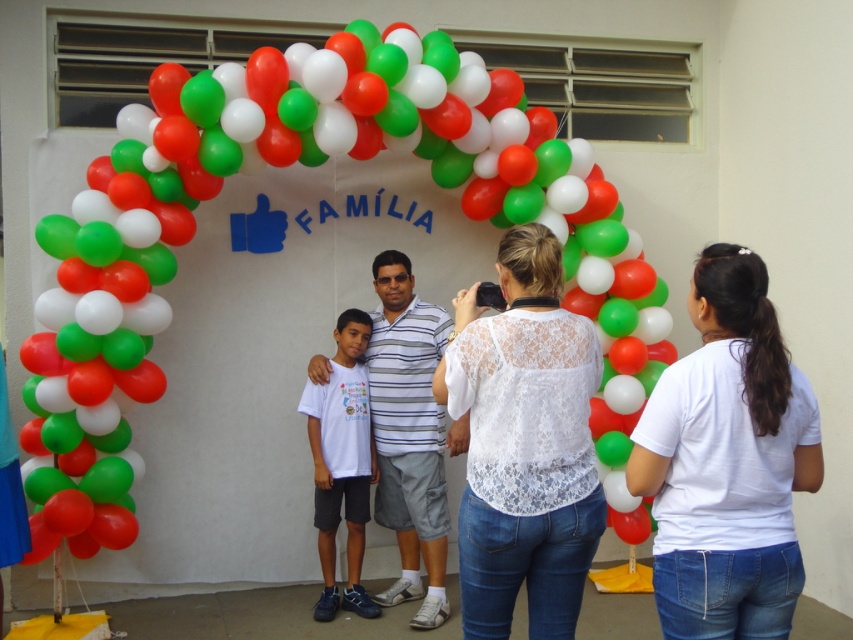
Question: Is white lace blouse at center behind white matte t-shirt at center?

Choices:
 (A) no
 (B) yes

Answer: (A)

Question: Can you confirm if rubber balloons at center is thinner than white matte t-shirt at center?

Choices:
 (A) no
 (B) yes

Answer: (A)

Question: Which of the following is the farthest from the observer?

Choices:
 (A) striped polo shirt at center
 (B) white lace blouse at center

Answer: (A)

Question: Which object is closer to the camera taking this photo?

Choices:
 (A) white lace shirt at center
 (B) rubber balloons at center
 (C) white matte t-shirt at center
 (D) striped polo shirt at center

Answer: (A)

Question: Is rubber balloons at center further to camera compared to striped polo shirt at center?

Choices:
 (A) yes
 (B) no

Answer: (B)

Question: Among these objects, which one is farthest from the camera?

Choices:
 (A) rubber balloons at center
 (B) striped polo shirt at center
 (C) white lace shirt at center

Answer: (B)